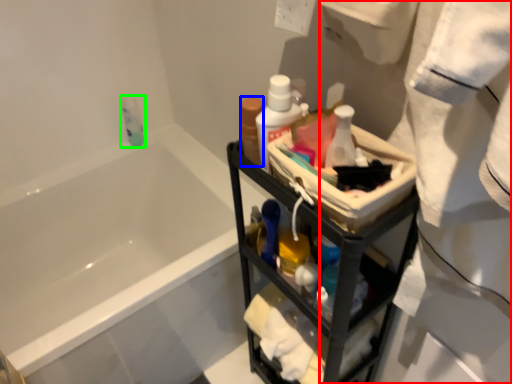
Question: Which is farther away from bath towel (highlighted by a red box)? mouthwash (highlighted by a blue box) or mouthwash (highlighted by a green box)?

Choices:
 (A) mouthwash
 (B) mouthwash

Answer: (B)